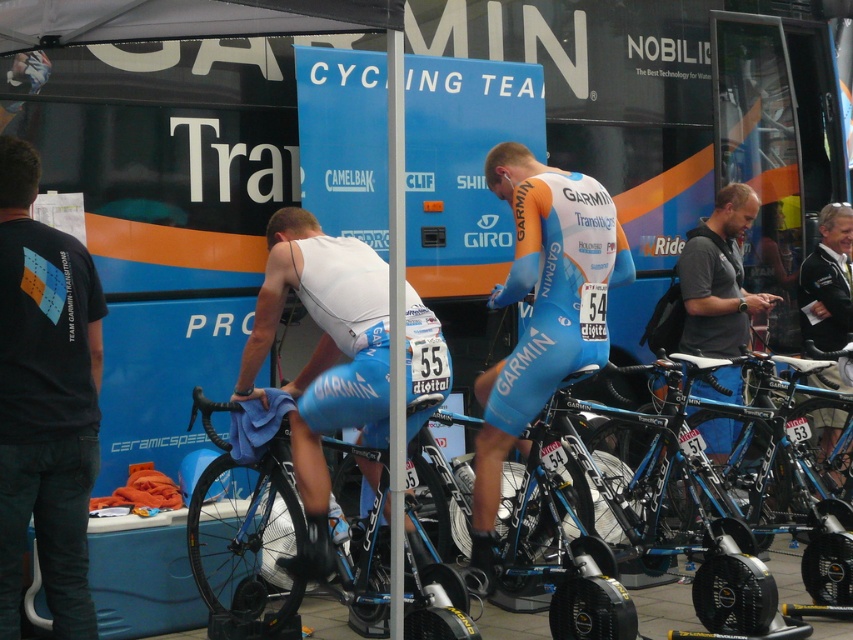
You are a photographer at the cycling event. You want to take a photo that includes both the white matte cycling jersey at center and the white plastic pole at center. Based on their positions, will the pole be visible in the background behind the jersey?

Yes, the white plastic pole at center is behind the white matte cycling jersey at center, so it will be visible in the background behind the jersey.

You are standing at the starting line of a cycling race and see two points marked on the track ahead. The first point is at coordinate point(9, 220) and the second point is at coordinate point(751, 307). Which point should you aim to reach first to stay on course?

You should aim to reach point(9, 220) first because it is in front of point(751, 307) along the track.